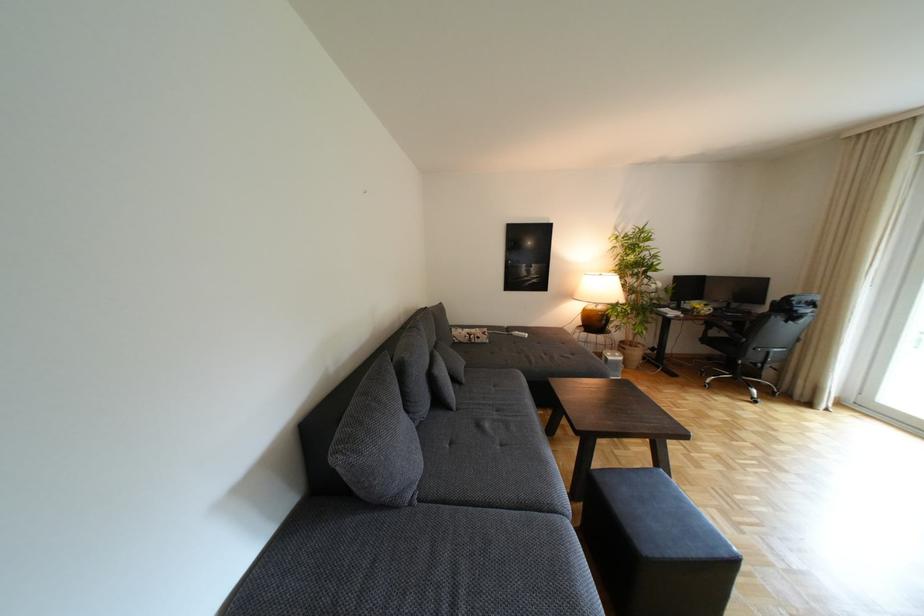
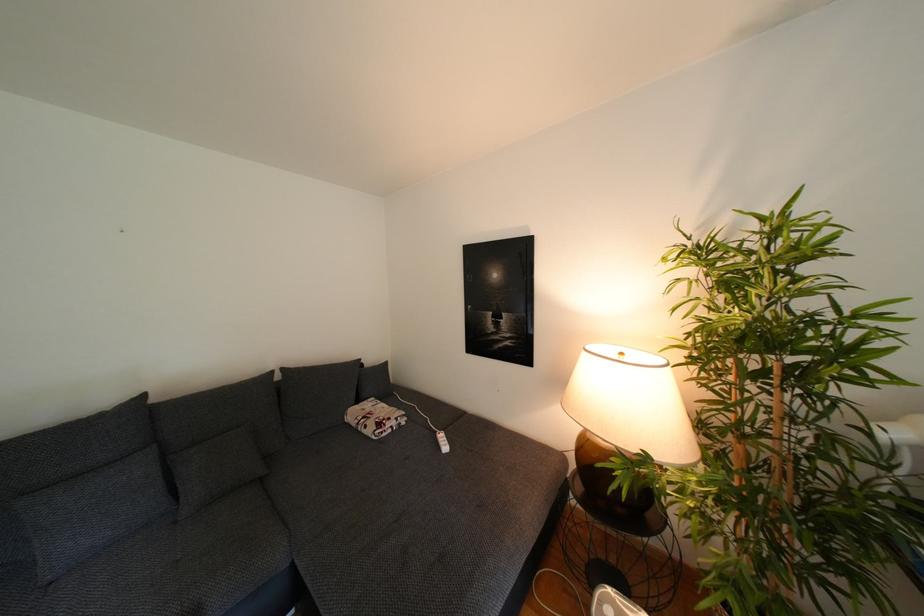
Where in the second image is the point corresponding to point 492,341 from the first image?

(378, 431)